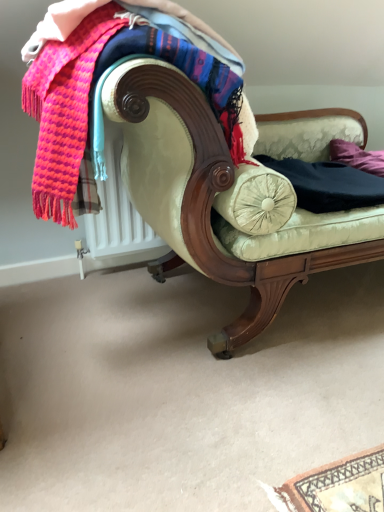
Question: Does knitted wool scarf at upper left come behind purple fabric pillow at right?

Choices:
 (A) yes
 (B) no

Answer: (B)

Question: Are knitted wool scarf at upper left and purple fabric pillow at right far apart?

Choices:
 (A) yes
 (B) no

Answer: (A)

Question: Can you confirm if knitted wool scarf at upper left is shorter than purple fabric pillow at right?

Choices:
 (A) no
 (B) yes

Answer: (A)

Question: Is knitted wool scarf at upper left bigger than purple fabric pillow at right?

Choices:
 (A) yes
 (B) no

Answer: (A)

Question: Is knitted wool scarf at upper left to the right of purple fabric pillow at right from the viewer's perspective?

Choices:
 (A) yes
 (B) no

Answer: (B)

Question: Considering the positions of point (380, 159) and point (332, 183), is point (380, 159) closer or farther from the camera than point (332, 183)?

Choices:
 (A) farther
 (B) closer

Answer: (A)

Question: From a real-world perspective, is purple fabric pillow at right above or below black cotton pants at center?

Choices:
 (A) below
 (B) above

Answer: (B)

Question: Considering the positions of purple fabric pillow at right and black cotton pants at center in the image, is purple fabric pillow at right wider or thinner than black cotton pants at center?

Choices:
 (A) thin
 (B) wide

Answer: (A)

Question: From the image's perspective, relative to black cotton pants at center, is purple fabric pillow at right above or below?

Choices:
 (A) above
 (B) below

Answer: (A)

Question: In the image, is purple fabric pillow at right positioned in front of or behind knitted wool scarf at upper left?

Choices:
 (A) front
 (B) behind

Answer: (B)

Question: Do you think purple fabric pillow at right is within knitted wool scarf at upper left, or outside of it?

Choices:
 (A) inside
 (B) outside

Answer: (B)

Question: From the image's perspective, relative to knitted wool scarf at upper left, is purple fabric pillow at right above or below?

Choices:
 (A) above
 (B) below

Answer: (A)

Question: From a real-world perspective, relative to knitted wool scarf at upper left, is purple fabric pillow at right vertically above or below?

Choices:
 (A) below
 (B) above

Answer: (A)

Question: Considering the positions of knitted wool scarf at upper left and black cotton pants at center in the image, is knitted wool scarf at upper left taller or shorter than black cotton pants at center?

Choices:
 (A) tall
 (B) short

Answer: (A)

Question: Does point [x=71, y=187] appear closer or farther from the camera than point [x=377, y=181]?

Choices:
 (A) farther
 (B) closer

Answer: (B)